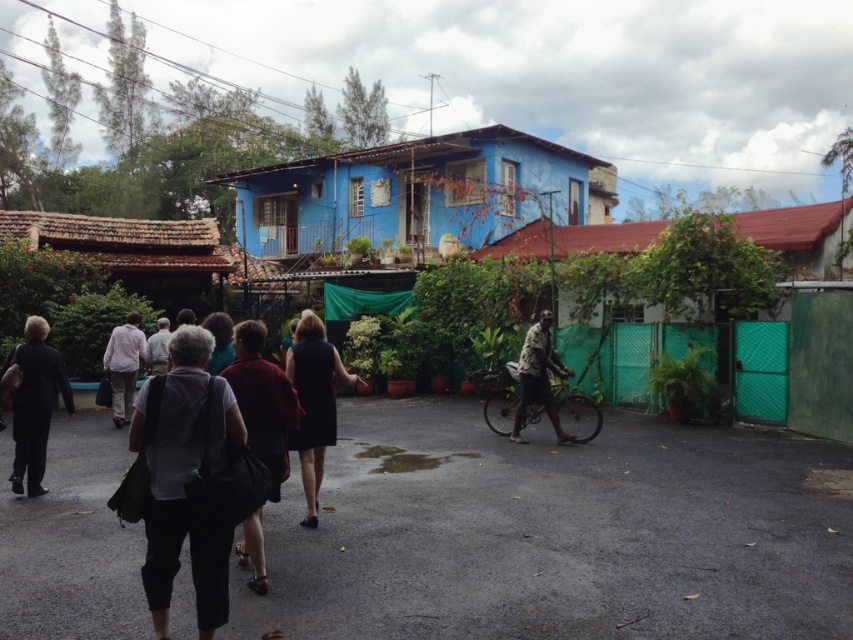
Question: Which point is farther to the camera?

Choices:
 (A) (219, 365)
 (B) (180, 324)
 (C) (218, 452)

Answer: (B)

Question: Can you confirm if dark brown textured shirt at center is positioned to the right of gray fabric bag at center?

Choices:
 (A) no
 (B) yes

Answer: (B)

Question: Which of these objects is positioned farthest from the dark gray fabric dress at center?

Choices:
 (A) gray fabric jacket at center
 (B) dark red fabric dress at center
 (C) dark blue dress at center

Answer: (A)

Question: Does dark gray fabric bag at center appear under dark blue dress at center?

Choices:
 (A) no
 (B) yes

Answer: (B)

Question: Can you confirm if dark gray suit at left is positioned to the left of dark brown textured shirt at center?

Choices:
 (A) yes
 (B) no

Answer: (A)

Question: Which object is the farthest from the dark blue dress at center?

Choices:
 (A) gray fabric jacket at center
 (B) dark gray fabric bag at center
 (C) dark brown textured shirt at center
 (D) gray fabric bag at center

Answer: (A)